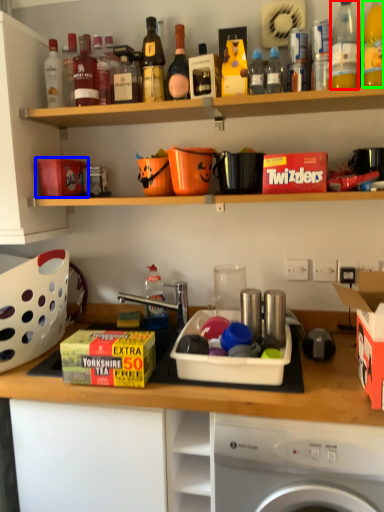
Question: Which object is positioned farthest from bottle (highlighted by a red box)? Select from box (highlighted by a blue box) and bottle (highlighted by a green box).

Choices:
 (A) box
 (B) bottle

Answer: (A)